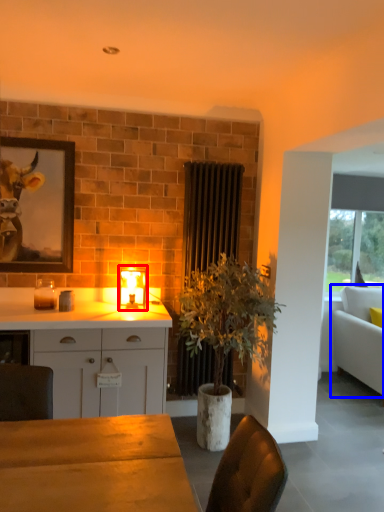
Question: Which object is closer to the camera taking this photo, lamp (highlighted by a red box) or studio couch (highlighted by a blue box)?

Choices:
 (A) lamp
 (B) studio couch

Answer: (A)